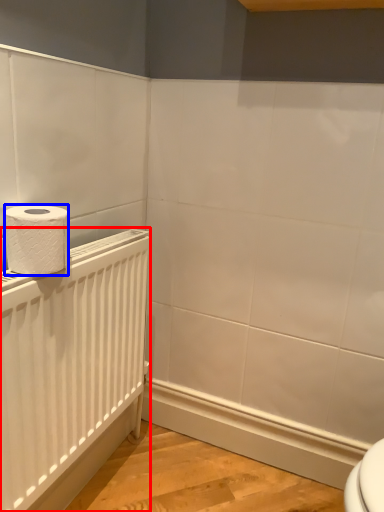
Question: Which of the following is the closest to the observer, radiator (highlighted by a red box) or toilet paper (highlighted by a blue box)?

Choices:
 (A) radiator
 (B) toilet paper

Answer: (A)